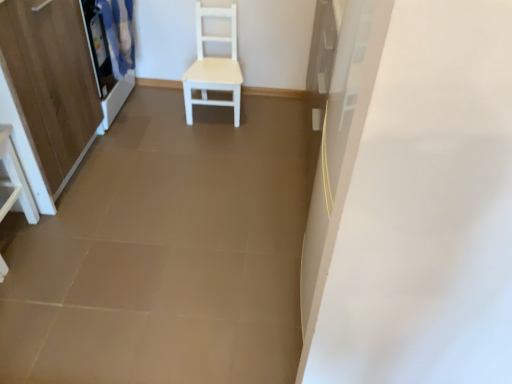
Identify the location of white glossy vanity at lower left. This screenshot has width=512, height=384. (14, 180).

At what (x,y) coordinates should I click in order to perform the action: click on wooden cabinet at left. Please return your answer as a coordinate pair (x, y). The image size is (512, 384). Looking at the image, I should click on (52, 80).

Locate an element on the screen. curtain above the white matte chair at center (from the image's perspective) is located at coordinates (118, 34).

Which object is closer to the camera taking this photo, matte white curtain at upper left or white matte chair at center?

matte white curtain at upper left is closer to the camera.

From the image's perspective, between matte white curtain at upper left and white matte chair at center, who is located below?

white matte chair at center, from the image's perspective.

Is wooden cabinet at left taller or shorter than matte white curtain at upper left?

Considering their sizes, wooden cabinet at left has more height than matte white curtain at upper left.

Considering the positions of points (38, 103) and (106, 29), is point (38, 103) closer to camera compared to point (106, 29)?

Yes, it is.

Which is more to the left, wooden cabinet at left or matte white curtain at upper left?

wooden cabinet at left is more to the left.

Who is smaller, wooden cabinet at left or matte white curtain at upper left?

matte white curtain at upper left.

Is white glossy vanity at lower left shorter than matte white curtain at upper left?

Yes.

Is white glossy vanity at lower left further to camera compared to matte white curtain at upper left?

No, white glossy vanity at lower left is in front of matte white curtain at upper left.

Is white glossy vanity at lower left oriented towards matte white curtain at upper left?

No, white glossy vanity at lower left is not oriented towards matte white curtain at upper left.

Relative to wooden cabinet at left, is white glossy vanity at lower left in front or behind?

In the image, white glossy vanity at lower left appears behind wooden cabinet at left.

Is white glossy vanity at lower left far away from wooden cabinet at left?

white glossy vanity at lower left is actually quite close to wooden cabinet at left.

Is white glossy vanity at lower left wider than wooden cabinet at left?

In fact, white glossy vanity at lower left might be narrower than wooden cabinet at left.

Which object is positioned more to the right, wooden cabinet at left or white matte chair at center?

From the viewer's perspective, white matte chair at center appears more on the right side.

Based on the photo, is wooden cabinet at left placed right next to white matte chair at center?

No, wooden cabinet at left is not next to white matte chair at center.

Which object is wider, wooden cabinet at left or white matte chair at center?

With larger width is wooden cabinet at left.

Considering the sizes of matte white curtain at upper left and white glossy vanity at lower left in the image, is matte white curtain at upper left wider or thinner than white glossy vanity at lower left?

In the image, matte white curtain at upper left appears to be more narrow than white glossy vanity at lower left.

Image resolution: width=512 pixels, height=384 pixels. What are the coordinates of `vanity on the left of matte white curtain at upper left` in the screenshot? It's located at (14, 180).

Does matte white curtain at upper left appear on the left side of white glossy vanity at lower left?

In fact, matte white curtain at upper left is to the right of white glossy vanity at lower left.

From the image's perspective, is matte white curtain at upper left on top of white glossy vanity at lower left?

Yes, from the image's perspective, matte white curtain at upper left is over white glossy vanity at lower left.

Find the location of a particular element. screen door that is above the white glossy vanity at lower left (from a real-world perspective) is located at coordinates (52, 80).

Which object is positioned more to the right, wooden cabinet at left or white glossy vanity at lower left?

white glossy vanity at lower left is more to the right.

Looking at this image, is white glossy vanity at lower left at the back of wooden cabinet at left?

Yes, white glossy vanity at lower left is at the back of wooden cabinet at left.

I want to click on chair to the right of matte white curtain at upper left, so click(x=214, y=67).

I want to click on curtain above the wooden cabinet at left (from the image's perspective), so click(x=118, y=34).

Considering their positions, is white matte chair at center positioned closer to matte white curtain at upper left than white glossy vanity at lower left?

white matte chair at center.

Looking at the image, which one is located further to white glossy vanity at lower left, wooden cabinet at left or white matte chair at center?

white matte chair at center lies further to white glossy vanity at lower left than the other object.

Estimate the real-world distances between objects in this image. Which object is closer to matte white curtain at upper left, wooden cabinet at left or white matte chair at center?

Based on the image, white matte chair at center appears to be nearer to matte white curtain at upper left.

Looking at the image, which one is located closer to white matte chair at center, wooden cabinet at left or white glossy vanity at lower left?

Among the two, wooden cabinet at left is located nearer to white matte chair at center.

From the image, which object appears to be nearer to white glossy vanity at lower left, white matte chair at center or wooden cabinet at left?

wooden cabinet at left.

Looking at the image, which one is located further to white matte chair at center, wooden cabinet at left or matte white curtain at upper left?

wooden cabinet at left is positioned further to the anchor white matte chair at center.

Estimate the real-world distances between objects in this image. Which object is further from white glossy vanity at lower left, wooden cabinet at left or matte white curtain at upper left?

matte white curtain at upper left is further to white glossy vanity at lower left.

When comparing their distances from matte white curtain at upper left, does white glossy vanity at lower left or white matte chair at center seem closer?

white matte chair at center.

Image resolution: width=512 pixels, height=384 pixels. What are the coordinates of `vanity positioned between wooden cabinet at left and white matte chair at center from near to far` in the screenshot? It's located at (14, 180).

At what (x,y) coordinates should I click in order to perform the action: click on chair between matte white curtain at upper left and white glossy vanity at lower left vertically. Please return your answer as a coordinate pair (x, y). Looking at the image, I should click on (214, 67).

What are the coordinates of `vanity located between wooden cabinet at left and matte white curtain at upper left in the depth direction` in the screenshot? It's located at (14, 180).

Locate an element on the screen. The height and width of the screenshot is (384, 512). curtain located between wooden cabinet at left and white matte chair at center in the depth direction is located at coordinates pos(118,34).